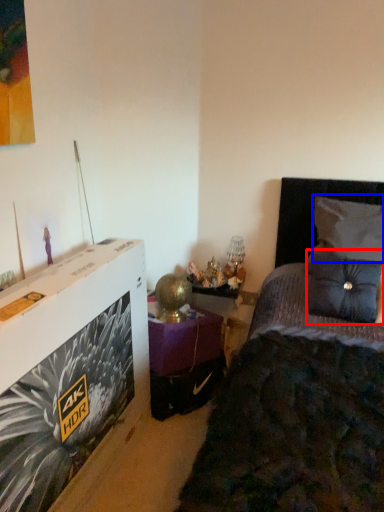
Question: Which of the following is the closest to the observer, pillow (highlighted by a red box) or pillow (highlighted by a blue box)?

Choices:
 (A) pillow
 (B) pillow

Answer: (A)